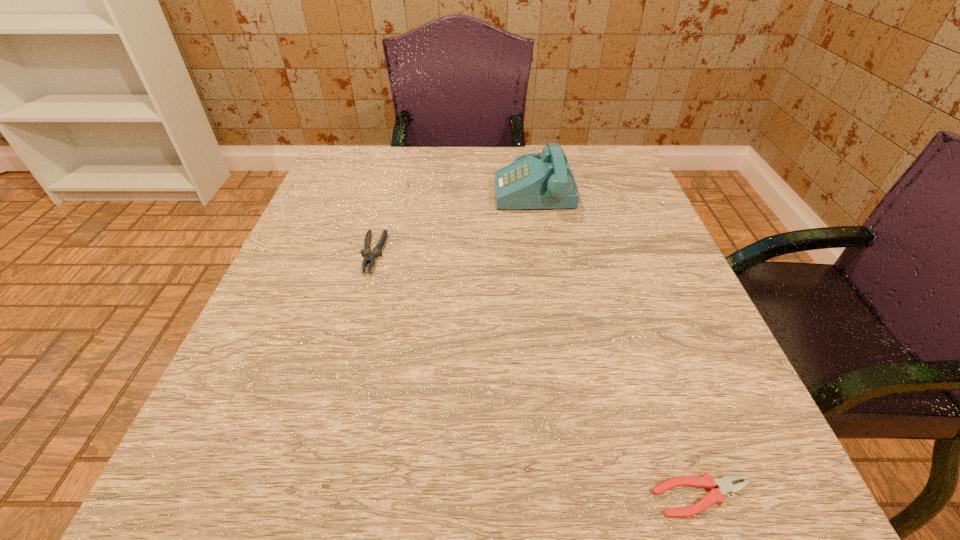
Find the location of a particular element. This screenshot has width=960, height=540. vacant space that is in between the shorter pliers and the leftmost object is located at coordinates (539, 375).

You are a GUI agent. You are given a task and a screenshot of the screen. Output one action in this format:
    pyautogui.click(x=<x>, y=<y>)
    Task: Click on the free space between the left pliers and the shorter pliers
    This screenshot has width=960, height=540.
    Given the screenshot: What is the action you would take?
    pyautogui.click(x=539, y=375)

The image size is (960, 540). Find the location of `vacant area between the farther pliers and the tallest object`. vacant area between the farther pliers and the tallest object is located at coordinates (453, 219).

This screenshot has height=540, width=960. Identify the location of free space between the telephone and the left pliers. pyautogui.click(x=453, y=219).

At what (x,y) coordinates should I click in order to perform the action: click on free space between the farther pliers and the tallest object. Please return your answer as a coordinate pair (x, y). The image size is (960, 540). Looking at the image, I should click on (453, 219).

Select which object appears as the second closest to the leftmost object. Please provide its 2D coordinates. Your answer should be formatted as a tuple, i.e. [(x, y)], where the tuple contains the x and y coordinates of a point satisfying the conditions above.

[(724, 485)]

Locate an element on the screen. The image size is (960, 540). object that is the closest to the farthest object is located at coordinates (370, 257).

The height and width of the screenshot is (540, 960). Find the location of `free space that satisfies the following two spatial constraints: 1. on the dial of the right pliers; 2. on the left side of the tallest object`. free space that satisfies the following two spatial constraints: 1. on the dial of the right pliers; 2. on the left side of the tallest object is located at coordinates (584, 497).

Where is `free space in the image that satisfies the following two spatial constraints: 1. on the dial of the tallest object; 2. at the gripping part of the taller pliers`? free space in the image that satisfies the following two spatial constraints: 1. on the dial of the tallest object; 2. at the gripping part of the taller pliers is located at coordinates (543, 253).

Locate an element on the screen. The image size is (960, 540). vacant space that satisfies the following two spatial constraints: 1. at the gripping part of the leftmost object; 2. on the left side of the shortest object is located at coordinates (306, 497).